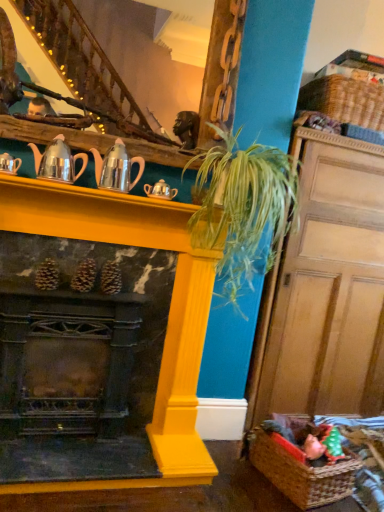
Question: Should I look upward or downward to see wooden staircase at upper center?

Choices:
 (A) up
 (B) down

Answer: (A)

Question: Is wooden door at right thinner than metallic silver teapot at upper left, which ranks as the 4th tea pot in right-to-left order?

Choices:
 (A) no
 (B) yes

Answer: (A)

Question: Is wooden door at right to the right of metallic silver teapot at upper left, which ranks as the 4th tea pot in right-to-left order, from the viewer's perspective?

Choices:
 (A) no
 (B) yes

Answer: (B)

Question: Is wooden door at right facing away from metallic silver teapot at upper left, acting as the 1th tea pot starting from the left?

Choices:
 (A) yes
 (B) no

Answer: (B)

Question: From a real-world perspective, is wooden door at right positioned under metallic silver teapot at upper left, acting as the 1th tea pot starting from the left, based on gravity?

Choices:
 (A) no
 (B) yes

Answer: (B)

Question: From the image's perspective, is wooden door at right beneath metallic silver teapot at upper left, which ranks as the 4th tea pot in right-to-left order?

Choices:
 (A) yes
 (B) no

Answer: (A)

Question: Is wooden door at right shorter than metallic silver teapot at upper left, which ranks as the 4th tea pot in right-to-left order?

Choices:
 (A) no
 (B) yes

Answer: (A)

Question: Does wooden staircase at upper center appear on the left side of metallic silver teapot at upper left, which ranks as the 4th tea pot in right-to-left order?

Choices:
 (A) no
 (B) yes

Answer: (A)

Question: Does wooden staircase at upper center have a lesser height compared to metallic silver teapot at upper left, acting as the 1th tea pot starting from the left?

Choices:
 (A) no
 (B) yes

Answer: (A)

Question: Does wooden staircase at upper center have a greater height compared to metallic silver teapot at upper left, which ranks as the 4th tea pot in right-to-left order?

Choices:
 (A) yes
 (B) no

Answer: (A)

Question: Is wooden staircase at upper center far from metallic silver teapot at upper left, which ranks as the 4th tea pot in right-to-left order?

Choices:
 (A) yes
 (B) no

Answer: (B)

Question: From the image's perspective, would you say wooden staircase at upper center is shown under metallic silver teapot at upper left, acting as the 1th tea pot starting from the left?

Choices:
 (A) yes
 (B) no

Answer: (B)

Question: Could you tell me if wooden staircase at upper center is turned towards metallic silver teapot at upper left, acting as the 1th tea pot starting from the left?

Choices:
 (A) no
 (B) yes

Answer: (A)

Question: Is yellow painted wood fireplace at center taller than metallic silver teapot at upper left, acting as the 1th tea pot starting from the left?

Choices:
 (A) no
 (B) yes

Answer: (B)